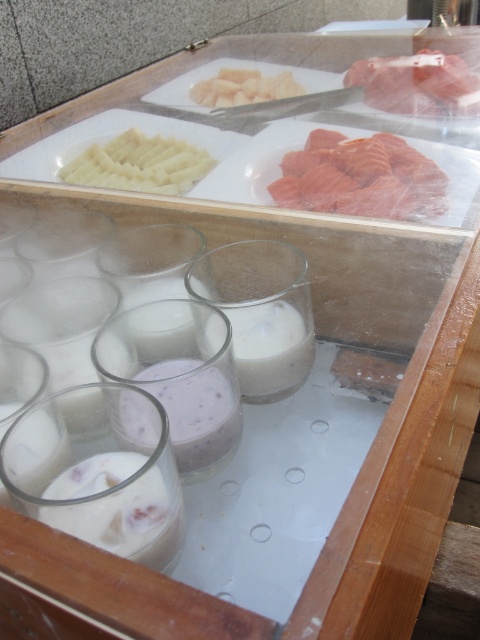
You are a delivery person who needs to place a new item between the purple creamy smoothie at center and the white creamy sliced potatoes at upper left. The item is 30 inches long. Will it fit between them?

The distance between the purple creamy smoothie at center and the white creamy sliced potatoes at upper left is 29.90 inches. Since the item is 30 inches long, it will not fit between them as it is slightly longer than the available space.